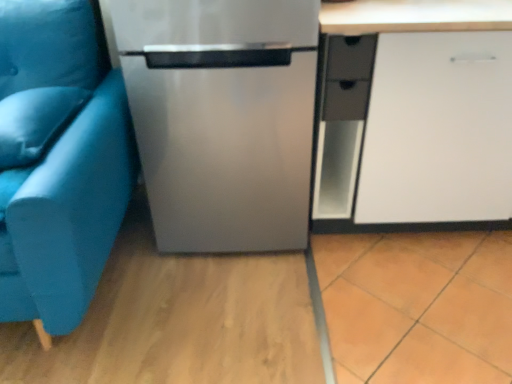
Question: Is stainless steel refrigerator at center facing towards teal fabric studio couch at left?

Choices:
 (A) no
 (B) yes

Answer: (A)

Question: Can you confirm if stainless steel refrigerator at center is bigger than teal fabric studio couch at left?

Choices:
 (A) yes
 (B) no

Answer: (B)

Question: Is stainless steel refrigerator at center thinner than teal fabric studio couch at left?

Choices:
 (A) no
 (B) yes

Answer: (B)

Question: Is there a large distance between stainless steel refrigerator at center and teal fabric studio couch at left?

Choices:
 (A) yes
 (B) no

Answer: (B)

Question: Can you confirm if stainless steel refrigerator at center is smaller than teal fabric studio couch at left?

Choices:
 (A) yes
 (B) no

Answer: (A)

Question: From the image's perspective, is matte black drawer at center right positioned above or below satin blue pillow at left?

Choices:
 (A) above
 (B) below

Answer: (A)

Question: In terms of size, does matte black drawer at center right appear bigger or smaller than satin blue pillow at left?

Choices:
 (A) big
 (B) small

Answer: (B)

Question: Is matte black drawer at center right taller or shorter than satin blue pillow at left?

Choices:
 (A) tall
 (B) short

Answer: (A)

Question: In the image, is matte black drawer at center right on the left side or the right side of satin blue pillow at left?

Choices:
 (A) left
 (B) right

Answer: (B)

Question: In terms of height, does teal fabric studio couch at left look taller or shorter compared to matte black drawer at center right?

Choices:
 (A) tall
 (B) short

Answer: (A)

Question: From a real-world perspective, is teal fabric studio couch at left physically located above or below matte black drawer at center right?

Choices:
 (A) above
 (B) below

Answer: (B)

Question: Is point (31, 117) positioned closer to the camera than point (357, 82)?

Choices:
 (A) closer
 (B) farther

Answer: (A)

Question: In the image, is teal fabric studio couch at left positioned in front of or behind matte black drawer at center right?

Choices:
 (A) front
 (B) behind

Answer: (A)

Question: Visually, is white matte cabinet at right positioned to the left or to the right of teal fabric studio couch at left?

Choices:
 (A) left
 (B) right

Answer: (B)

Question: From a real-world perspective, is white matte cabinet at right physically located above or below teal fabric studio couch at left?

Choices:
 (A) below
 (B) above

Answer: (A)